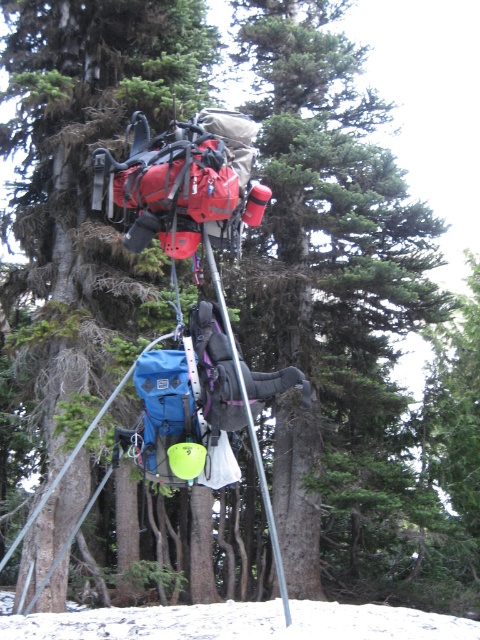
In the scene shown: You are a hiker trying to locate your gear in the forest. You remember that your green matte backpack at center is hanging from a tree. Based on the coordinates provided, can you confirm if the point at [87,189] is where your green matte backpack at center is located?

Yes, the point at [87,189] corresponds to the green matte backpack at center, so it is correctly located there.

You are a hiker who wants to take a photo of the green matte tree at center and the white powdery snow at lower center. Which object should you focus on first if you want both to be in focus?

The green matte tree at center is above the white powdery snow at lower center, so you should focus on the green matte tree at center first to ensure both are in focus.